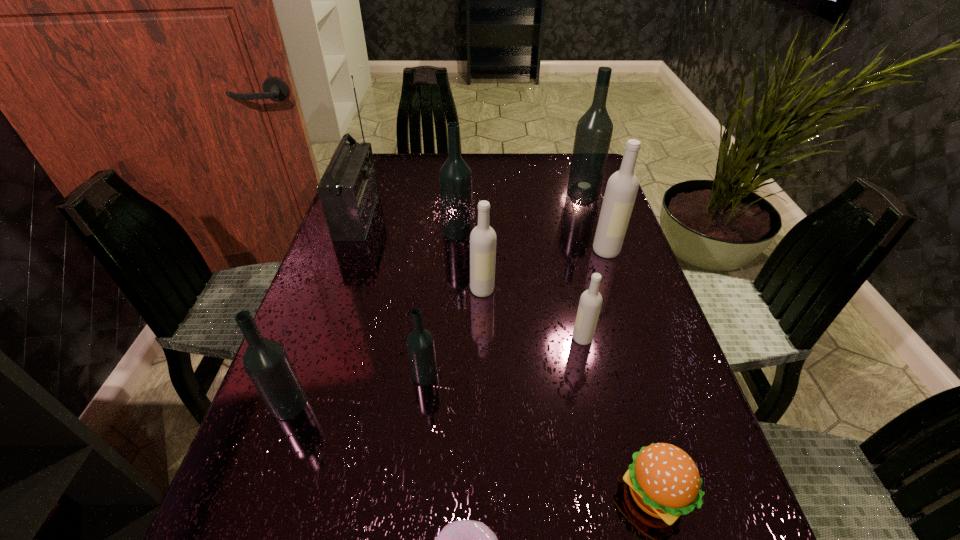
Where is `object that is the third closest one to the third smallest black vodka`? The height and width of the screenshot is (540, 960). object that is the third closest one to the third smallest black vodka is located at coordinates (594, 129).

Identify which vodka is located as the sixth nearest to the second farthest white vodka. Please provide its 2D coordinates. Your answer should be formatted as a tuple, i.e. [(x, y)], where the tuple contains the x and y coordinates of a point satisfying the conditions above.

[(594, 129)]

Identify which vodka is the fourth nearest to the second farthest black vodka. Please provide its 2D coordinates. Your answer should be formatted as a tuple, i.e. [(x, y)], where the tuple contains the x and y coordinates of a point satisfying the conditions above.

[(590, 303)]

Find the location of a particular element. black vodka that is the closest to the smallest black vodka is located at coordinates click(266, 362).

Locate an element on the screen. the second closest black vodka to the biggest black vodka is located at coordinates (420, 343).

The width and height of the screenshot is (960, 540). I want to click on white vodka that is the second closest to the fourth nearest object, so click(590, 303).

Select which white vodka is the second closest to the farthest white vodka. Please provide its 2D coordinates. Your answer should be formatted as a tuple, i.e. [(x, y)], where the tuple contains the x and y coordinates of a point satisfying the conditions above.

[(483, 237)]

Identify the location of free spot that satisfies the following two spatial constraints: 1. on the front side of the sixth farthest object; 2. on the right side of the hamburger. The image size is (960, 540). (615, 494).

At what (x,y) coordinates should I click in order to perform the action: click on vacant space that satisfies the following two spatial constraints: 1. on the back side of the rightmost white vodka; 2. on the left side of the nearest black vodka. Please return your answer as a coordinate pair (x, y). The width and height of the screenshot is (960, 540). Looking at the image, I should click on (343, 251).

I want to click on blank area in the image that satisfies the following two spatial constraints: 1. on the front side of the third nearest black vodka; 2. on the left side of the second nearest white vodka, so click(x=454, y=290).